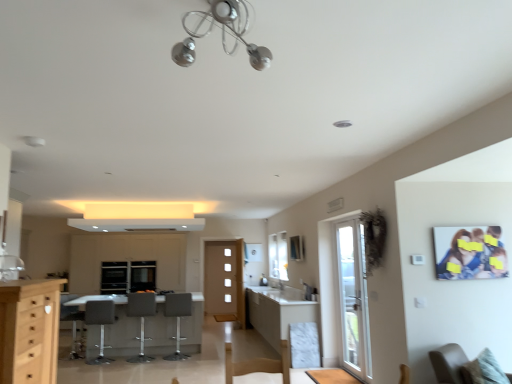
The width and height of the screenshot is (512, 384). What are the coordinates of `empty space that is ontop of matte photo frame at upper right (from a real-world perspective)` in the screenshot? It's located at (461, 225).